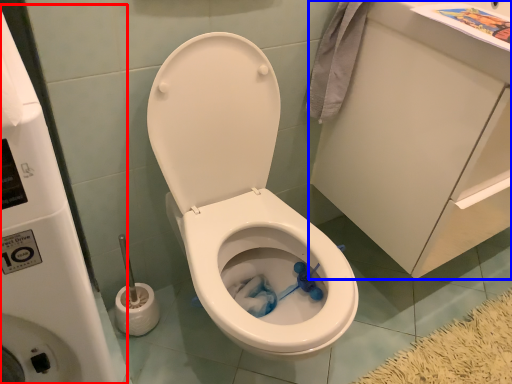
Question: Which of the following is the closest to the observer, water tank (highlighted by a red box) or porcelain (highlighted by a blue box)?

Choices:
 (A) water tank
 (B) porcelain

Answer: (A)